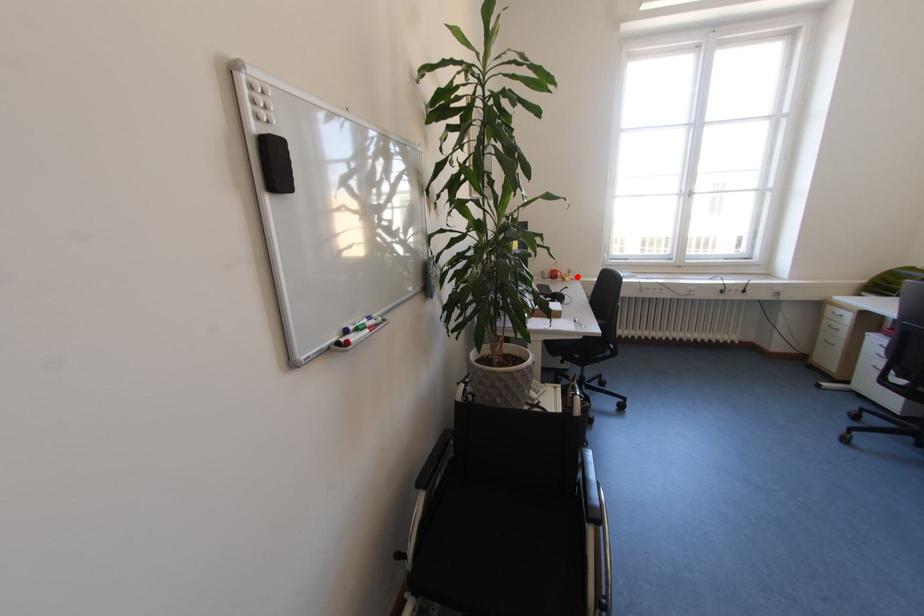
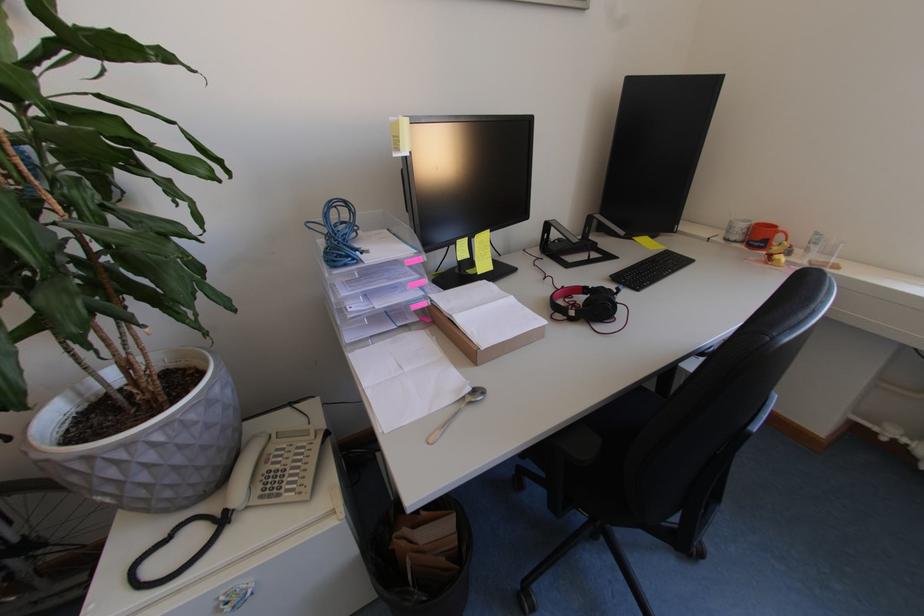
Question: I am providing you with two images of the same scene from different viewpoints. In image1, a red point is highlighted. Considering the same 3D point in image2, which of the following is correct?

Choices:
 (A) It is closer
 (B) It is farther

Answer: (B)